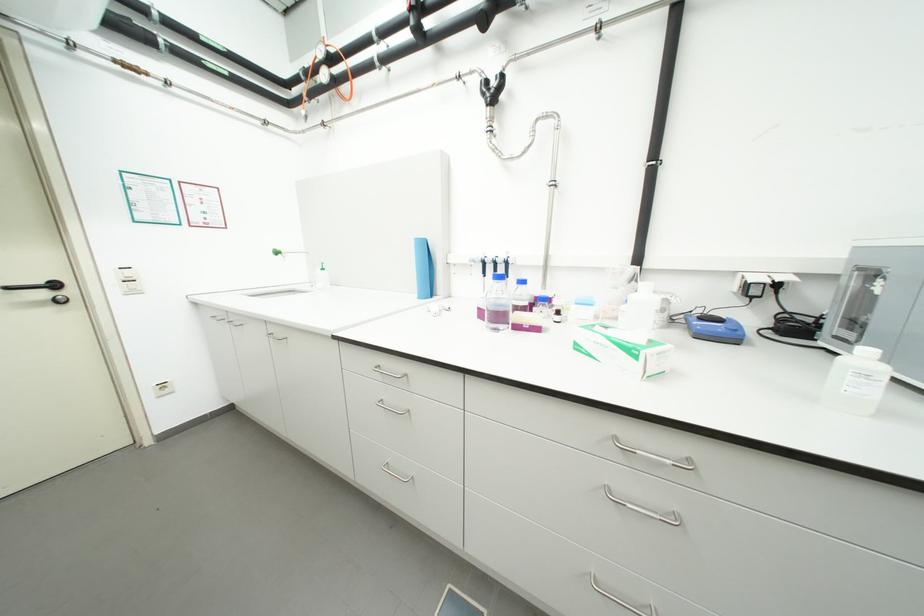
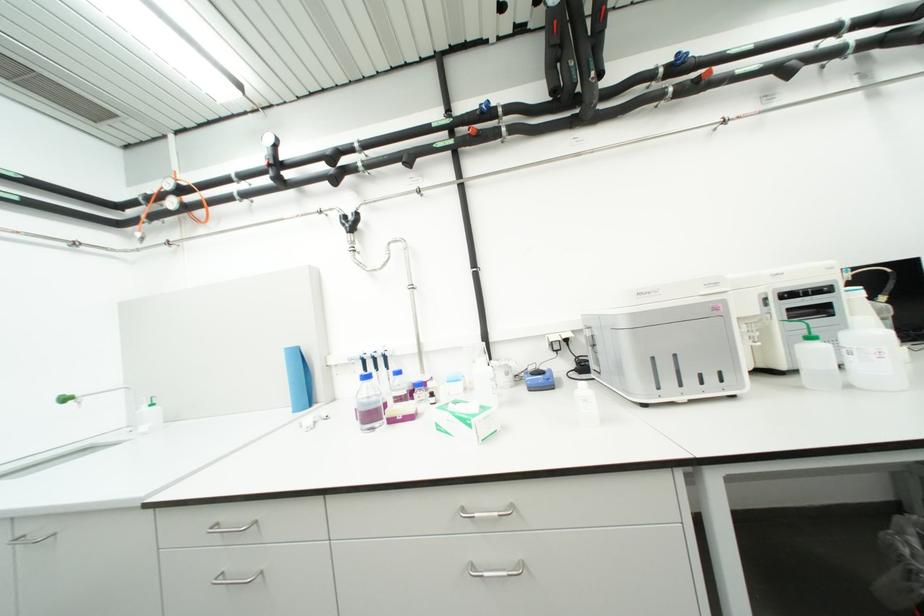
In the second image, find the point that corresponds to the point at 637,507 in the first image.

(493, 575)